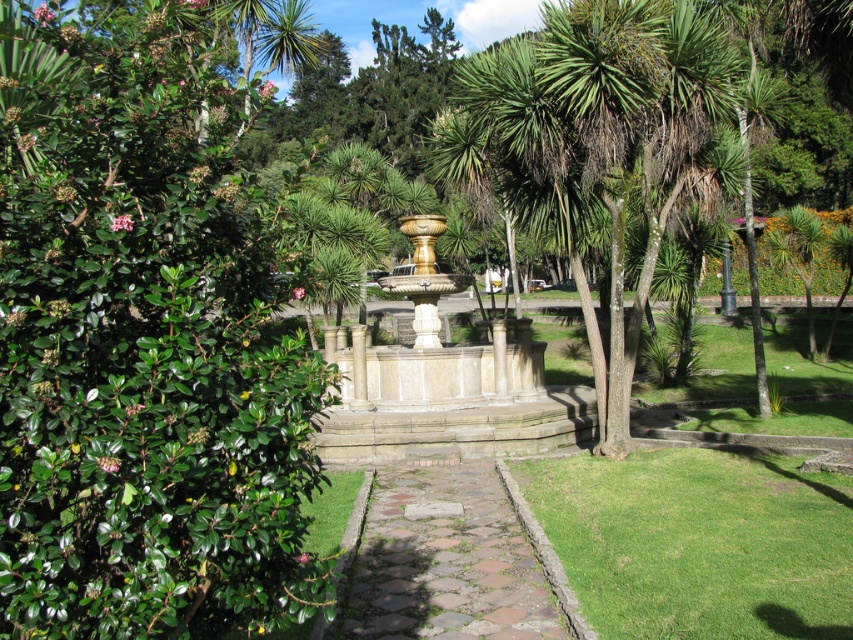
Can you confirm if green leafy bush at left is smaller than gold polished stone fountain at center?

Actually, green leafy bush at left might be larger than gold polished stone fountain at center.

Which of these two, green leafy bush at left or gold polished stone fountain at center, stands shorter?

green leafy bush at left is shorter.

Identify the location of green leafy bush at left. The width and height of the screenshot is (853, 640). (142, 340).

Is point (416, 388) closer to viewer compared to point (477, 579)?

No, (416, 388) is behind (477, 579).

The image size is (853, 640). Identify the location of gold polished stone fountain at center. (444, 381).

Who is more distant from viewer, (x=494, y=108) or (x=769, y=234)?

The point (x=769, y=234) is more distant.

Between point (624, 72) and point (809, 241), which one is positioned behind?

The point (809, 241) is more distant.

Identify the location of green leafy palm tree at center. The image size is (853, 640). [x=595, y=145].